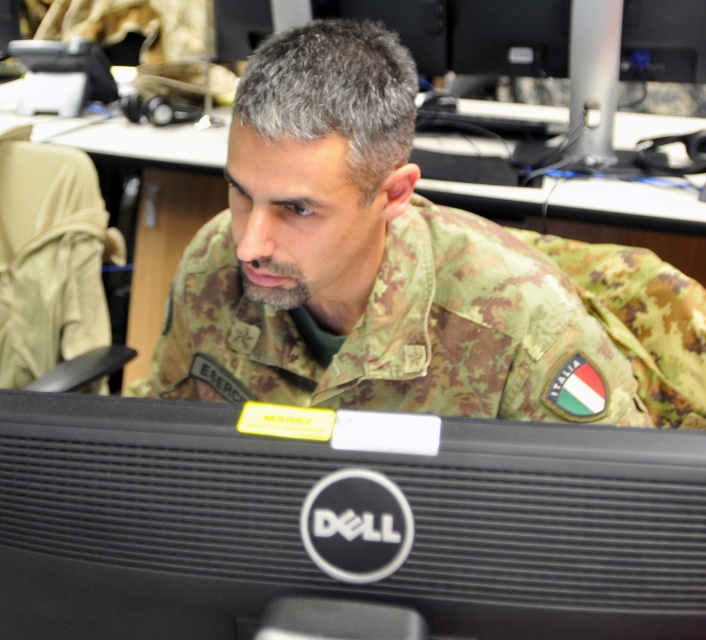
You are a photographer trying to capture a closeup of the two points on the desk in the image. Which point, point (x=501, y=512) or point (x=573, y=314), is closer to the camera and should be focused on first?

Point (x=501, y=512) is closer to the camera than point (x=573, y=314), so it should be focused on first.

You are an office assistant tasked with organizing the desk. You need to place a new item between the black plastic monitor at center and the camouflage fabric uniform at center. Which object should you place the new item closer to if the item is larger than both?

Since the black plastic monitor at center is smaller than the camouflage fabric uniform at center, the new item should be placed closer to the camouflage fabric uniform at center as it is larger and can accommodate the space better.